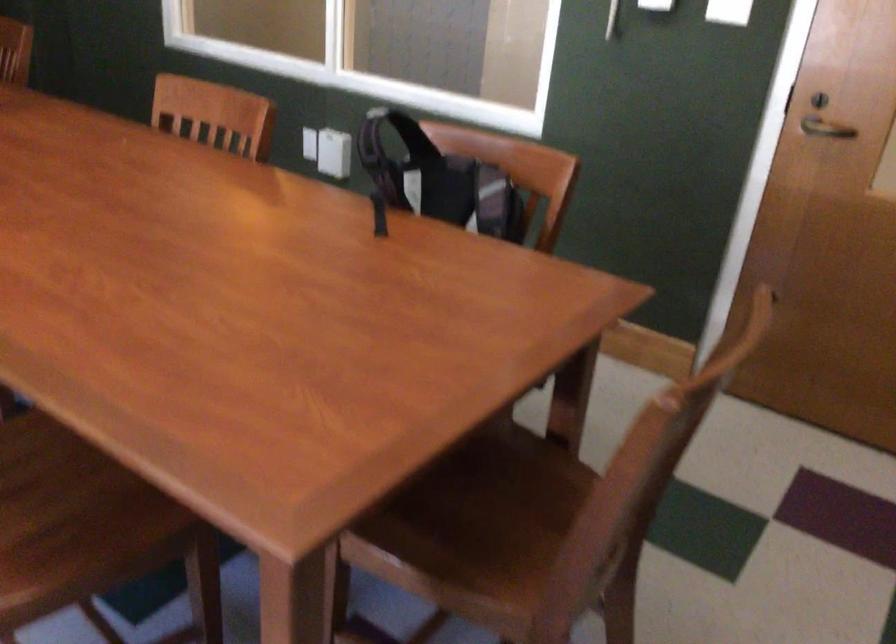
Find where to pull the dark door handle. Please return your answer as a coordinate pair (x, y).

(824, 129)